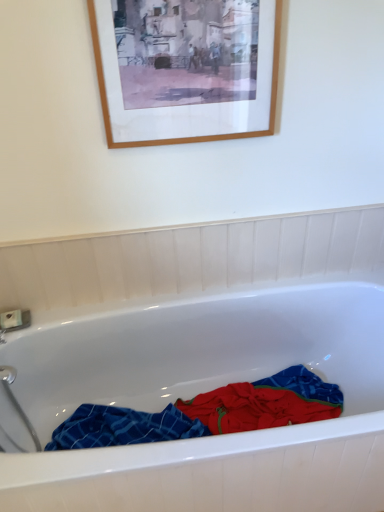
Question: Is white glossy bathtub at center with wooden picture frame at upper center?

Choices:
 (A) no
 (B) yes

Answer: (A)

Question: Does white glossy bathtub at center lie in front of wooden picture frame at upper center?

Choices:
 (A) yes
 (B) no

Answer: (A)

Question: Is the position of white glossy bathtub at center more distant than that of wooden picture frame at upper center?

Choices:
 (A) yes
 (B) no

Answer: (B)

Question: From a real-world perspective, is white glossy bathtub at center below wooden picture frame at upper center?

Choices:
 (A) no
 (B) yes

Answer: (B)

Question: Is white glossy bathtub at center bigger than wooden picture frame at upper center?

Choices:
 (A) no
 (B) yes

Answer: (B)

Question: In terms of width, does white glossy bathtub at center look wider or thinner when compared to blue plaid towel at center?

Choices:
 (A) wide
 (B) thin

Answer: (A)

Question: Would you say white glossy bathtub at center is to the left or to the right of blue plaid towel at center in the picture?

Choices:
 (A) right
 (B) left

Answer: (A)

Question: Considering the positions of point (195, 300) and point (286, 398), is point (195, 300) closer or farther from the camera than point (286, 398)?

Choices:
 (A) closer
 (B) farther

Answer: (A)

Question: Considering the positions of white glossy bathtub at center and blue plaid towel at center in the image, is white glossy bathtub at center taller or shorter than blue plaid towel at center?

Choices:
 (A) tall
 (B) short

Answer: (A)

Question: Choose the correct answer: Is white glossy bathtub at center inside wooden picture frame at upper center or outside it?

Choices:
 (A) inside
 (B) outside

Answer: (B)

Question: Is white glossy bathtub at center in front of or behind wooden picture frame at upper center in the image?

Choices:
 (A) behind
 (B) front

Answer: (B)

Question: From the image's perspective, is white glossy bathtub at center positioned above or below wooden picture frame at upper center?

Choices:
 (A) below
 (B) above

Answer: (A)

Question: Considering the positions of white glossy bathtub at center and wooden picture frame at upper center in the image, is white glossy bathtub at center bigger or smaller than wooden picture frame at upper center?

Choices:
 (A) big
 (B) small

Answer: (A)

Question: From a real-world perspective, is blue plaid towel at center above or below wooden picture frame at upper center?

Choices:
 (A) below
 (B) above

Answer: (A)

Question: In the image, is blue plaid towel at center positioned in front of or behind wooden picture frame at upper center?

Choices:
 (A) behind
 (B) front

Answer: (A)